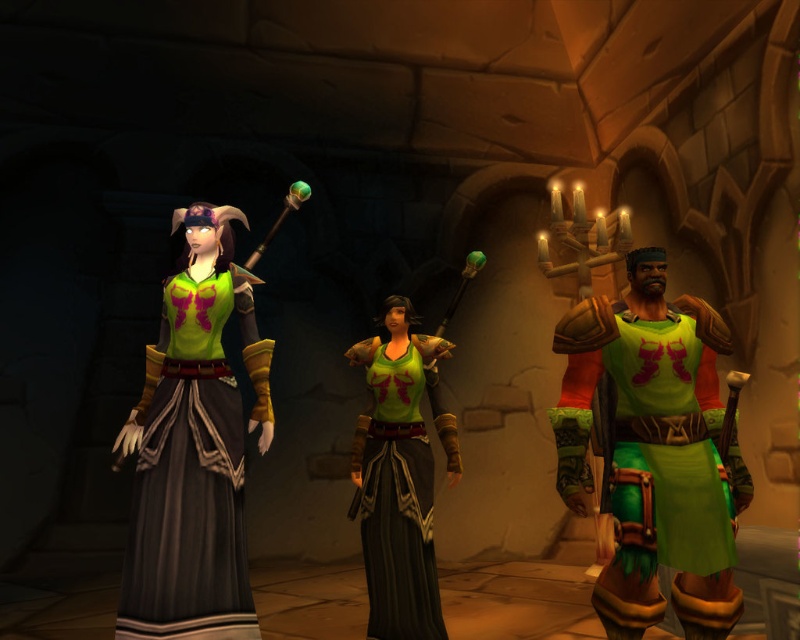
Who is more forward, [694,436] or [218,451]?

Positioned in front is point [694,436].

Locate an element on the screen. This screenshot has width=800, height=640. green matte vest at right is located at coordinates point(654,451).

What are the coordinates of `green matte vest at right` in the screenshot? It's located at (654, 451).

Is green matte vest at right below green matte tank top at center?

No.

Is point (674, 451) closer to viewer compared to point (376, 387)?

Yes.

Locate an element on the screen. This screenshot has height=640, width=800. green matte vest at right is located at coordinates (654, 451).

Is green matte dress at center closer to the viewer compared to green matte tank top at center?

Yes, green matte dress at center is closer to the viewer.

Consider the image. Between green matte dress at center and green matte tank top at center, which one is positioned lower?

green matte tank top at center is below.

Measure the distance between green matte dress at center and camera.

A distance of 2.80 meters exists between green matte dress at center and camera.

Locate an element on the screen. The width and height of the screenshot is (800, 640). green matte dress at center is located at coordinates (193, 468).